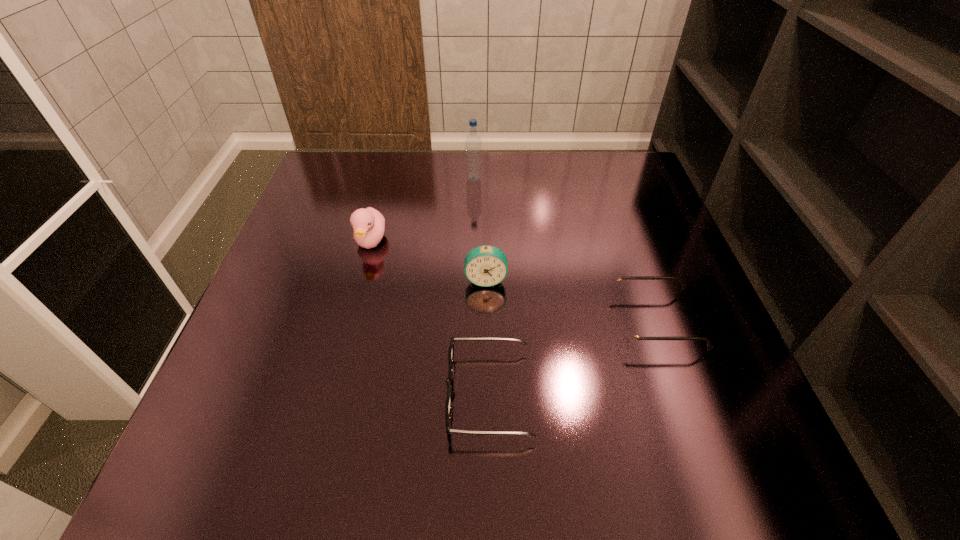
Identify the location of the tallest object. The width and height of the screenshot is (960, 540). (473, 142).

At what (x,y) coordinates should I click in order to perform the action: click on the farthest object. Please return your answer as a coordinate pair (x, y). Looking at the image, I should click on (473, 142).

You are a GUI agent. You are given a task and a screenshot of the screen. Output one action in this format:
    pyautogui.click(x=<x>, y=<y>)
    Task: Click on the fourth nearest object
    
    Given the screenshot: What is the action you would take?
    pyautogui.click(x=368, y=224)

At what (x,y) coordinates should I click in order to perform the action: click on the leftmost object. Please return your answer as a coordinate pair (x, y). The height and width of the screenshot is (540, 960). Looking at the image, I should click on (368, 224).

Find the location of a particular element. Image resolution: width=960 pixels, height=540 pixels. the third farthest object is located at coordinates (485, 266).

This screenshot has height=540, width=960. I want to click on the right spectacles, so point(630,333).

At what (x,y) coordinates should I click in order to perform the action: click on the left spectacles. Please return your answer as a coordinate pair (x, y). The image size is (960, 540). Looking at the image, I should click on [448, 405].

Locate an element on the screen. This screenshot has height=540, width=960. blank space located on the right of the tallest object is located at coordinates (543, 179).

Identify the location of vacant space located 0.210m on the front-facing side of the duckling. The width and height of the screenshot is (960, 540). (348, 333).

At what (x,y) coordinates should I click in order to perform the action: click on vacant space located on the front-facing side of the alarm clock. Please return your answer as a coordinate pair (x, y). The height and width of the screenshot is (540, 960). Looking at the image, I should click on (486, 311).